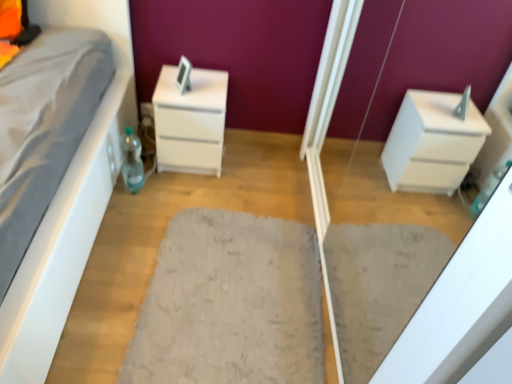
At what (x,y) coordinates should I click in order to perform the action: click on free location to the right of white glossy chest of drawers at center. Please return your answer as a coordinate pair (x, y). The height and width of the screenshot is (384, 512). Looking at the image, I should click on coord(247,170).